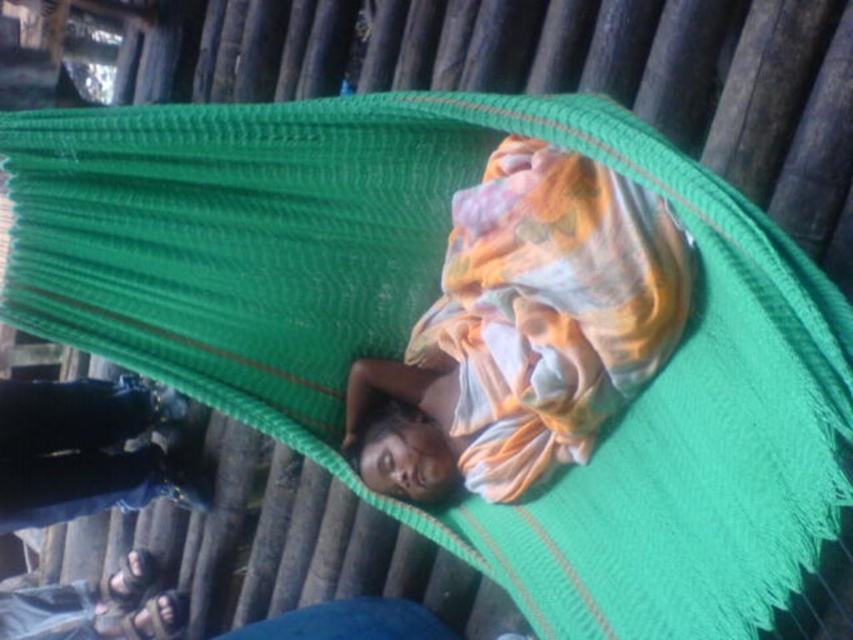
Question: Is multicolored fabric at center positioned before denim pants at lower left?

Choices:
 (A) yes
 (B) no

Answer: (A)

Question: Where is multicolored fabric at center located in relation to denim pants at lower left in the image?

Choices:
 (A) below
 (B) above

Answer: (B)

Question: Is multicolored fabric at center above denim pants at lower left?

Choices:
 (A) yes
 (B) no

Answer: (A)

Question: Which point is farther to the camera?

Choices:
 (A) (596, 252)
 (B) (94, 392)

Answer: (B)

Question: Which of the following is the closest to the observer?

Choices:
 (A) (13, 490)
 (B) (546, 275)

Answer: (B)